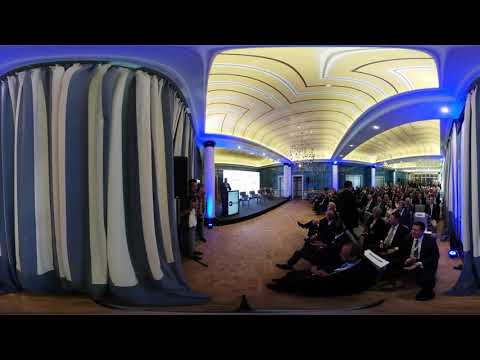
Where is `light on ceiling`? The image size is (480, 360). light on ceiling is located at coordinates (444, 109), (375, 127), (351, 146), (342, 154), (336, 164), (300, 166), (278, 160), (263, 154), (238, 147).